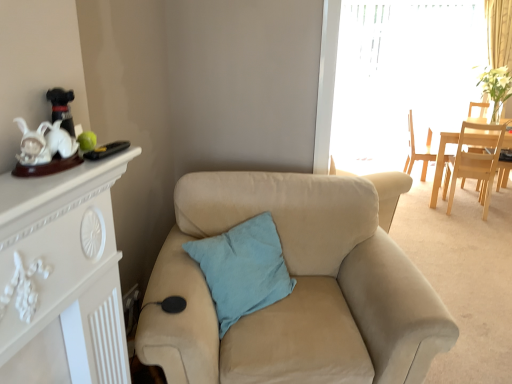
Question: Is light wood chair at upper right, which is the first chair in back-to-front order, next to beige fabric armchair at center and touching it?

Choices:
 (A) no
 (B) yes

Answer: (A)

Question: Considering the relative positions of light wood chair at upper right, which is the first chair in back-to-front order, and beige fabric armchair at center in the image provided, is light wood chair at upper right, which is the first chair in back-to-front order, in front of beige fabric armchair at center?

Choices:
 (A) no
 (B) yes

Answer: (A)

Question: Is light wood chair at upper right, which is the first chair in back-to-front order, wider than beige fabric armchair at center?

Choices:
 (A) yes
 (B) no

Answer: (A)

Question: From the image's perspective, is light wood chair at upper right, which is the first chair in back-to-front order, beneath beige fabric armchair at center?

Choices:
 (A) no
 (B) yes

Answer: (A)

Question: Could you tell me if light wood chair at upper right, which is the first chair in back-to-front order, is facing beige fabric armchair at center?

Choices:
 (A) no
 (B) yes

Answer: (B)

Question: Does beige fabric armchair at center have a greater height compared to light wood chair at upper right, marked as the second chair in a front-to-back arrangement?

Choices:
 (A) yes
 (B) no

Answer: (B)

Question: Could light wood chair at upper right, which is the first chair in back-to-front order, be considered to be inside beige fabric armchair at center?

Choices:
 (A) no
 (B) yes

Answer: (A)

Question: Is beige fabric armchair at center aimed at light wood chair at upper right, marked as the second chair in a front-to-back arrangement?

Choices:
 (A) yes
 (B) no

Answer: (A)

Question: From the image's perspective, is beige fabric armchair at center beneath light wood chair at upper right, marked as the second chair in a front-to-back arrangement?

Choices:
 (A) yes
 (B) no

Answer: (A)

Question: Can you confirm if beige fabric armchair at center is thinner than light wood chair at upper right, which is the first chair in back-to-front order?

Choices:
 (A) yes
 (B) no

Answer: (A)

Question: Is beige fabric armchair at center further to the viewer compared to light wood chair at upper right, which is the first chair in back-to-front order?

Choices:
 (A) no
 (B) yes

Answer: (A)

Question: Would you say light blue cotton pillow at center is part of beige fabric armchair at center's contents?

Choices:
 (A) no
 (B) yes

Answer: (A)